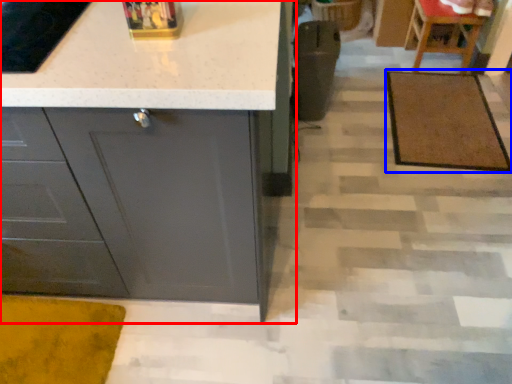
Question: Which of the following is the farthest to the observer, cabinetry (highlighted by a red box) or doormat (highlighted by a blue box)?

Choices:
 (A) cabinetry
 (B) doormat

Answer: (B)